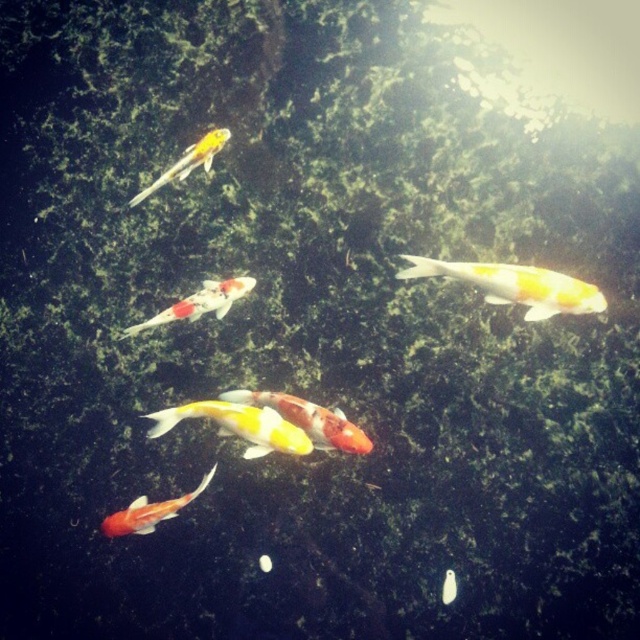
You are a photographer trying to capture a photo of the koi fish in the pond. You notice two points in the water where fish are swimming. The first point is at coordinates point (154, 323), and the second point is at point (221, 128). If you want to focus on the fish that is closer to you, which point should you aim your camera at?

Point (154, 323) is in front of point (221, 128), so you should aim your camera at point (154, 323) to focus on the fish that is closer to you.